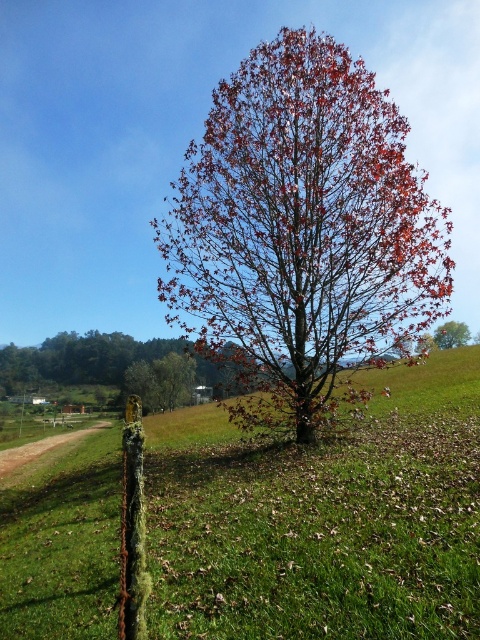
Can you confirm if green grassy at center is positioned below smooth brown tree at center?

Correct, green grassy at center is located below smooth brown tree at center.

Is green grassy at center positioned in front of smooth brown tree at center?

That is True.

Where is `green grassy at center`? green grassy at center is located at coordinates (323, 518).

Does reddish-brown bark tree at center have a greater height compared to smooth brown tree at center?

Result: Yes, reddish-brown bark tree at center is taller than smooth brown tree at center.

Is reddish-brown bark tree at center bigger than smooth brown tree at center?

Correct, reddish-brown bark tree at center is larger in size than smooth brown tree at center.

Who is more distant from viewer, (x=315, y=67) or (x=463, y=342)?

The point (x=463, y=342) is more distant.

Where is `reddish-brown bark tree at center`? reddish-brown bark tree at center is located at coordinates (301, 232).

Which is behind, point (166, 580) or point (365, 266)?

Positioned behind is point (365, 266).

This screenshot has height=640, width=480. Identify the location of green grassy at center. (323, 518).